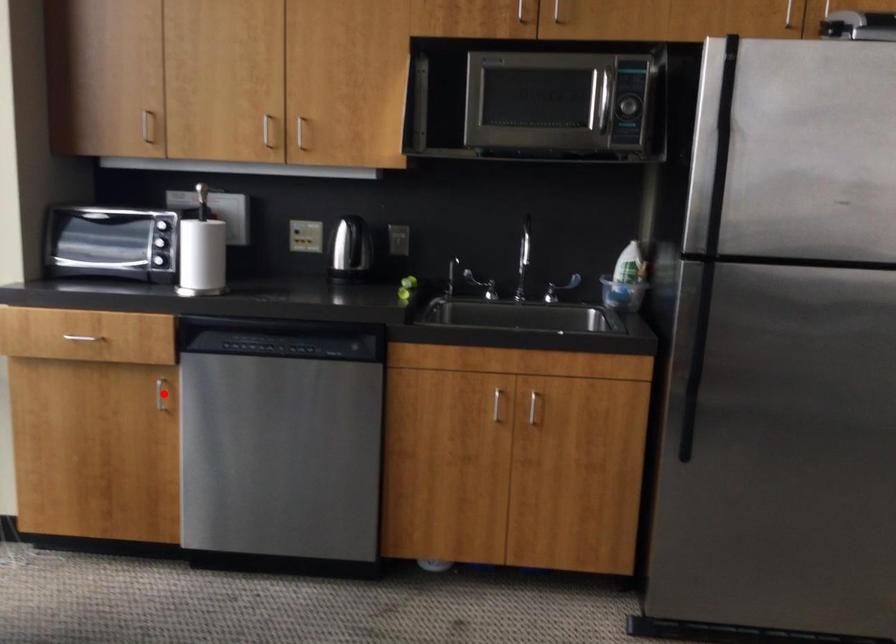
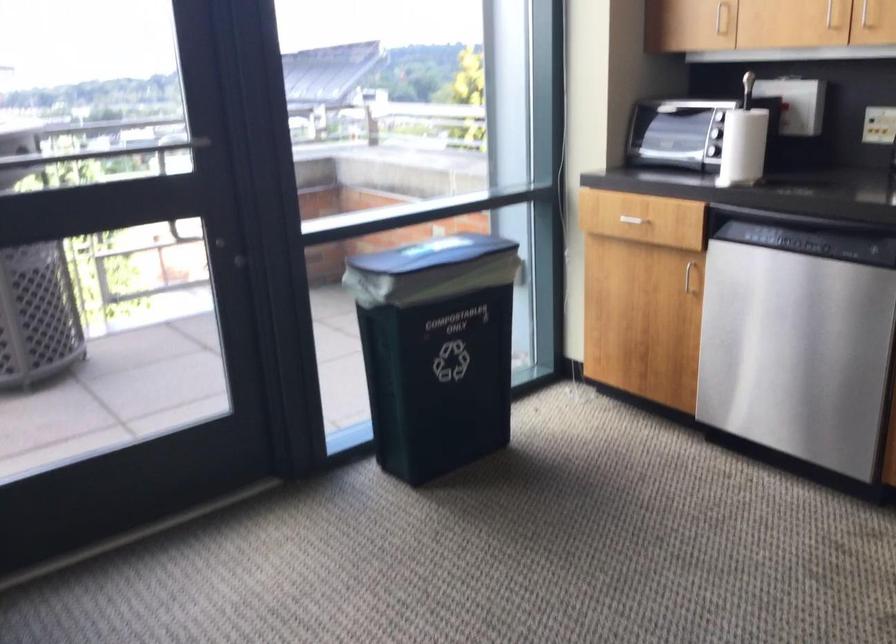
The point at the highlighted location is marked in the first image. Where is the corresponding point in the second image?

(690, 276)